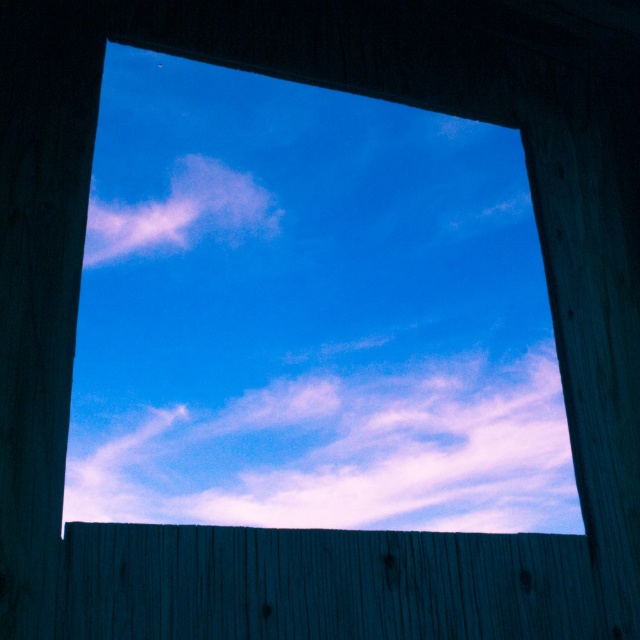
Question: Among these points, which one is farthest from the camera?

Choices:
 (A) (589, 573)
 (B) (417, 397)
 (C) (540, 410)

Answer: (C)

Question: Which object is the farthest from the white fluffy cloud at center?

Choices:
 (A) transparent glass window at center
 (B) smooth wooden fence at bottom

Answer: (B)

Question: Considering the relative positions of smooth wooden fence at bottom and pink cotton cloud at upper center in the image provided, where is smooth wooden fence at bottom located with respect to pink cotton cloud at upper center?

Choices:
 (A) below
 (B) above

Answer: (A)

Question: Among these points, which one is farthest from the camera?

Choices:
 (A) (172, 180)
 (B) (272, 490)
 (C) (216, 561)
 (D) (458, 474)

Answer: (D)

Question: Can you confirm if transparent glass window at center is bigger than pink cotton cloud at upper center?

Choices:
 (A) yes
 (B) no

Answer: (A)

Question: Can you confirm if white fluffy cloud at center is wider than smooth wooden fence at bottom?

Choices:
 (A) yes
 (B) no

Answer: (B)